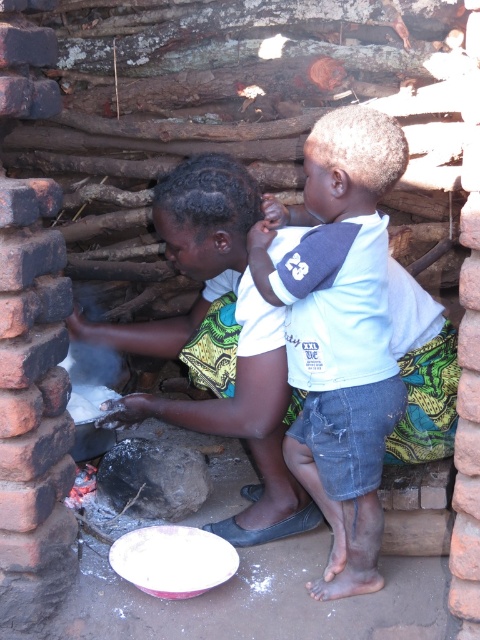
Looking at this image, does green printed fabric at center have a lesser width compared to white cotton shirt at center?

Incorrect, green printed fabric at center's width is not less than white cotton shirt at center's.

Which is below, green printed fabric at center or white cotton shirt at center?

Positioned lower is white cotton shirt at center.

The width and height of the screenshot is (480, 640). I want to click on green printed fabric at center, so click(x=219, y=342).

Based on the photo, between green printed fabric at center and white matte rock at lower center, which one has more height?

green printed fabric at center is taller.

Who is more forward, (x=247, y=301) or (x=88, y=392)?

Positioned in front is point (x=247, y=301).

Identify the location of green printed fabric at center. (219, 342).

Between white cotton shirt at center and white matte rock at lower center, which one is positioned lower?

white matte rock at lower center

Measure the distance between white cotton shirt at center and white matte rock at lower center.

A distance of 37.50 inches exists between white cotton shirt at center and white matte rock at lower center.

Is point (322, 436) positioned after point (85, 416)?

No, (322, 436) is closer to viewer.

I want to click on white cotton shirt at center, so click(339, 332).